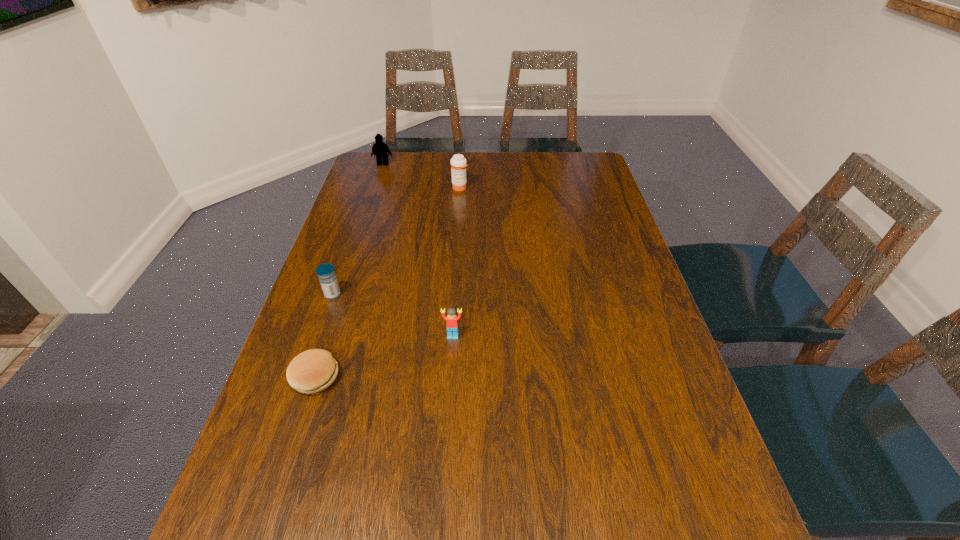
The width and height of the screenshot is (960, 540). What are the coordinates of `vacant area that lies between the farther medicine and the nearer medicine` in the screenshot? It's located at (396, 241).

I want to click on unoccupied position between the left medicine and the second nearest object, so click(x=393, y=315).

This screenshot has width=960, height=540. What are the coordinates of `empty space between the patty and the farthest object` in the screenshot? It's located at (349, 271).

Locate an element on the screen. The height and width of the screenshot is (540, 960). empty space between the nearer Lego and the shortest object is located at coordinates (384, 356).

Where is `free space between the farthest object and the shortest object`? free space between the farthest object and the shortest object is located at coordinates (349, 271).

This screenshot has height=540, width=960. Identify the location of object that stands as the closest to the farther Lego. (458, 163).

Image resolution: width=960 pixels, height=540 pixels. Find the location of `the second closest object to the shortest object`. the second closest object to the shortest object is located at coordinates (452, 319).

Identify the location of free space that satisfies the following two spatial constraints: 1. on the face of the taller medicine; 2. on the right side of the farthest object. (375, 188).

Where is `vacant position in the image that satisfies the following two spatial constraints: 1. on the face of the right medicine; 2. on the left side of the farther Lego`? This screenshot has width=960, height=540. vacant position in the image that satisfies the following two spatial constraints: 1. on the face of the right medicine; 2. on the left side of the farther Lego is located at coordinates (375, 188).

Locate an element on the screen. Image resolution: width=960 pixels, height=540 pixels. vacant space that satisfies the following two spatial constraints: 1. on the front side of the patty; 2. on the left side of the shorter medicine is located at coordinates (304, 377).